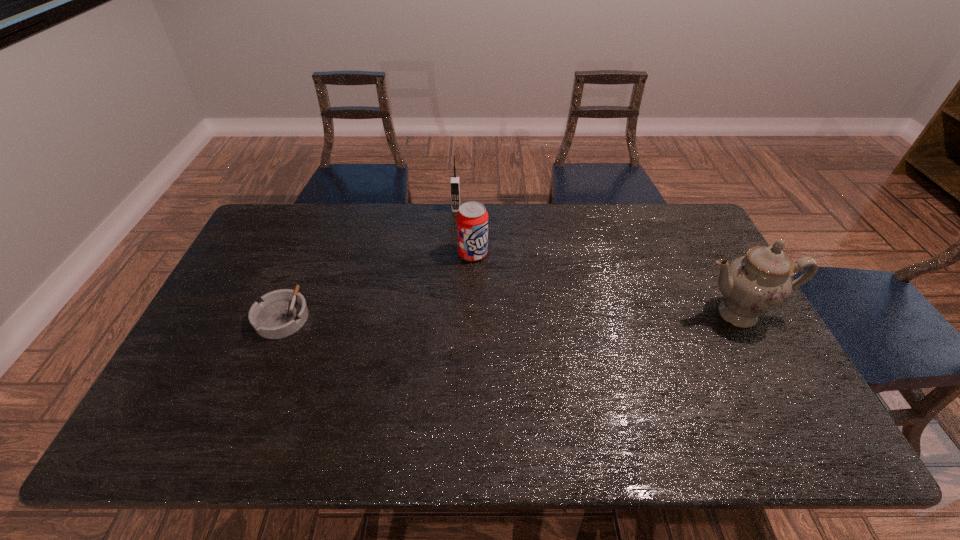
Find the location of `vacant area at the far edge of the desktop`. vacant area at the far edge of the desktop is located at coordinates pos(601,215).

Find the location of a particular element. This screenshot has width=960, height=540. vacant space at the near edge of the desktop is located at coordinates (293, 379).

Find the location of a particular element. vacant space at the right edge of the desktop is located at coordinates (772, 360).

This screenshot has height=540, width=960. What are the coordinates of `vacant region at the far left corner` in the screenshot? It's located at (252, 243).

The height and width of the screenshot is (540, 960). I want to click on blank space at the far right corner, so click(x=673, y=217).

Image resolution: width=960 pixels, height=540 pixels. Find the location of `vacant space that is in between the ashtray and the third object from left to right`. vacant space that is in between the ashtray and the third object from left to right is located at coordinates (378, 285).

Find the location of a particular element. The image size is (960, 540). free spot between the second object from left to right and the leftmost object is located at coordinates (370, 262).

You are a GUI agent. You are given a task and a screenshot of the screen. Output one action in this format:
    pyautogui.click(x=<x>, y=<y>)
    Task: Click on the vacant area that lies between the rightmost object and the soda can
    
    Given the screenshot: What is the action you would take?
    pyautogui.click(x=605, y=284)

The image size is (960, 540). In order to click on free point between the soda can and the ashtray in this screenshot , I will do pyautogui.click(x=378, y=285).

Identify the location of free area in between the tallest object and the soda can. The height and width of the screenshot is (540, 960). [x=605, y=284].